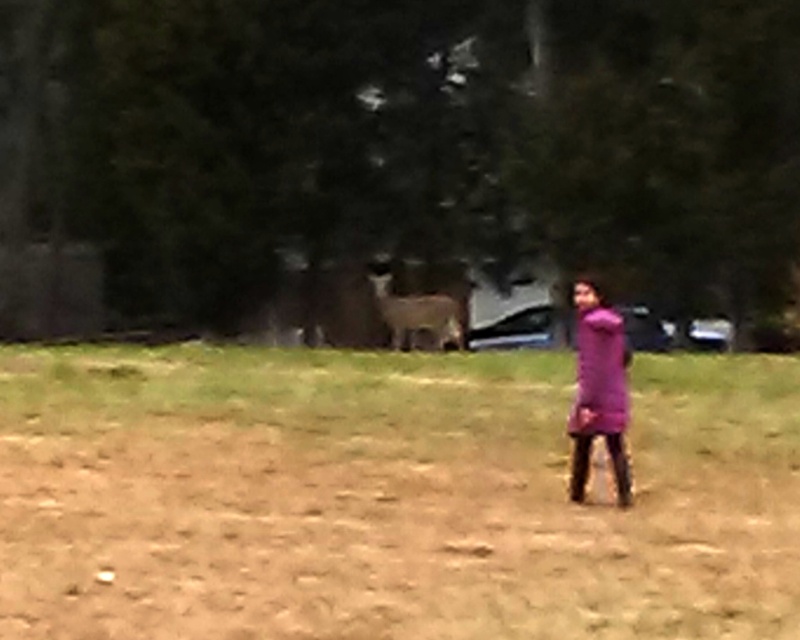
You are standing in the outdoor scene and want to walk from the green grass at center to the purple matte dress at center. Which direction should you move in relation to the objects?

Since the green grass at center is further to the viewer than the purple matte dress at center, you should move forward towards the purple matte dress at center to reach it from the green grass at center.

You are standing in the outdoor scene and want to walk from point A to point B. Point A is at coordinates point (476, 422) and point B is at coordinates point (582, 326). Which point should you start from if you want to walk towards the deer?

You should start from point A at coordinates point (476, 422) because it is closer to you than point B at coordinates point (582, 326), so walking from point A towards the deer would be the correct starting point.